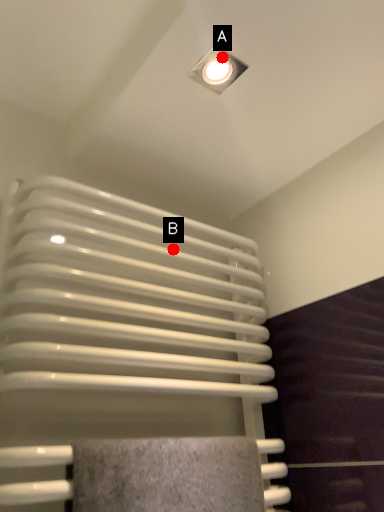
Question: Two points are circled on the image, labeled by A and B beside each circle. Which point is farther to the camera?

Choices:
 (A) A is further
 (B) B is further

Answer: (B)